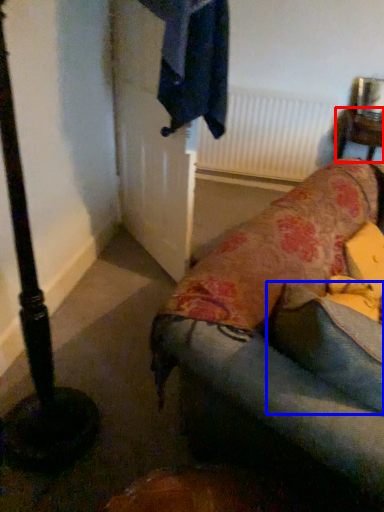
Question: Among these objects, which one is nearest to the camera, furniture (highlighted by a red box) or pillow (highlighted by a blue box)?

Choices:
 (A) furniture
 (B) pillow

Answer: (B)